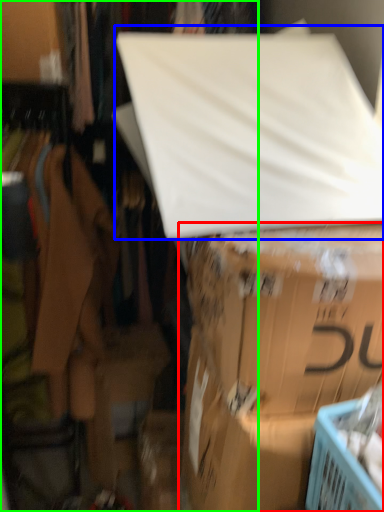
Question: Which object is positioned closest to box (highlighted by a red box)? Select from linen (highlighted by a blue box) and closet (highlighted by a green box).

Choices:
 (A) linen
 (B) closet

Answer: (A)